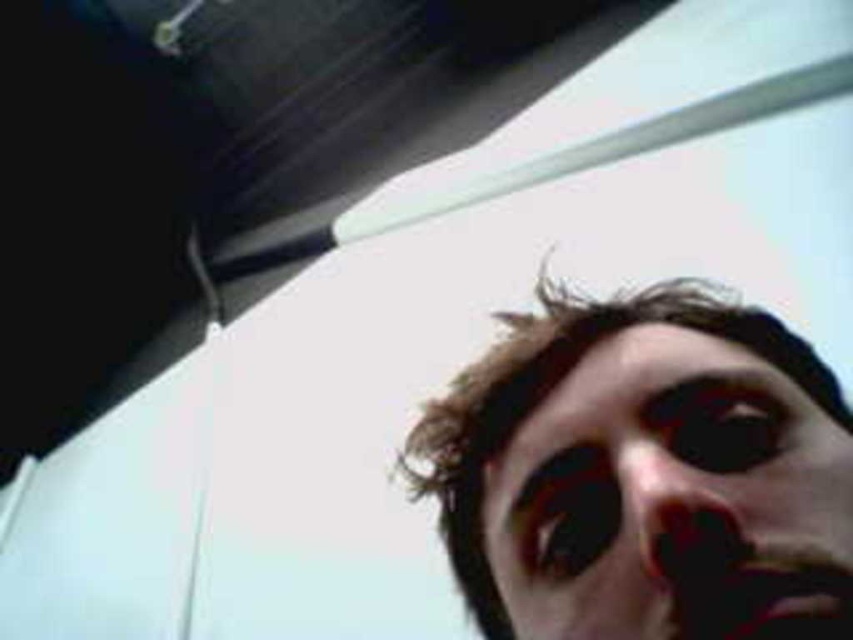
Which is in front, point (701, 560) or point (672, 476)?

Point (701, 560) is more forward.

Between smooth skin face at bottom right and smooth skin nose at center, which one appears on the left side from the viewer's perspective?

smooth skin nose at center is more to the left.

Consider the image. Measure the distance between smooth skin face at bottom right and camera.

smooth skin face at bottom right and camera are 12.80 inches apart.

Where is `smooth skin face at bottom right`? smooth skin face at bottom right is located at coordinates (672, 499).